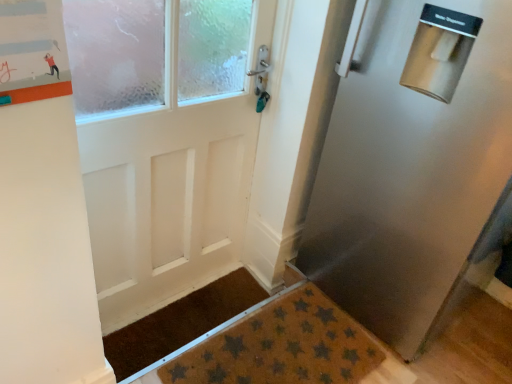
Question: From the image's perspective, does brown textured doormat at lower center, which appears as the second doormat when viewed from the back, appear lower than orange matte bulletin board at upper left?

Choices:
 (A) no
 (B) yes

Answer: (B)

Question: Can you confirm if brown textured doormat at lower center, which appears as the first doormat when viewed from the front, is positioned to the left of orange matte bulletin board at upper left?

Choices:
 (A) no
 (B) yes

Answer: (A)

Question: From the image's perspective, would you say brown textured doormat at lower center, which appears as the second doormat when viewed from the back, is positioned over orange matte bulletin board at upper left?

Choices:
 (A) no
 (B) yes

Answer: (A)

Question: Is brown textured doormat at lower center, which appears as the second doormat when viewed from the back, turned away from orange matte bulletin board at upper left?

Choices:
 (A) yes
 (B) no

Answer: (B)

Question: From a real-world perspective, is brown textured doormat at lower center, which appears as the second doormat when viewed from the back, below orange matte bulletin board at upper left?

Choices:
 (A) no
 (B) yes

Answer: (B)

Question: Is brown textured doormat at lower center, which appears as the second doormat when viewed from the back, positioned with its back to brown textured mat at lower center, which appears as the 1th doormat when viewed from the back?

Choices:
 (A) yes
 (B) no

Answer: (B)

Question: Is brown textured doormat at lower center, which appears as the second doormat when viewed from the back, shorter than brown textured mat at lower center, which appears as the 1th doormat when viewed from the back?

Choices:
 (A) yes
 (B) no

Answer: (B)

Question: From a real-world perspective, is brown textured doormat at lower center, which appears as the second doormat when viewed from the back, over brown textured mat at lower center, which appears as the 1th doormat when viewed from the back?

Choices:
 (A) no
 (B) yes

Answer: (B)

Question: Would you say brown textured doormat at lower center, which appears as the second doormat when viewed from the back, contains brown textured mat at lower center, which appears as the 1th doormat when viewed from the back?

Choices:
 (A) yes
 (B) no

Answer: (B)

Question: Is brown textured doormat at lower center, which appears as the second doormat when viewed from the back, to the right of brown textured mat at lower center, which appears as the 1th doormat when viewed from the back, from the viewer's perspective?

Choices:
 (A) yes
 (B) no

Answer: (A)

Question: From a real-world perspective, is brown textured doormat at lower center, which appears as the second doormat when viewed from the back, located beneath brown textured mat at lower center, which appears as the 1th doormat when viewed from the back?

Choices:
 (A) yes
 (B) no

Answer: (B)

Question: Considering the relative sizes of brown textured mat at lower center, acting as the 2th doormat starting from the front, and brown textured doormat at lower center, which appears as the first doormat when viewed from the front, in the image provided, is brown textured mat at lower center, acting as the 2th doormat starting from the front, taller than brown textured doormat at lower center, which appears as the first doormat when viewed from the front,?

Choices:
 (A) no
 (B) yes

Answer: (A)